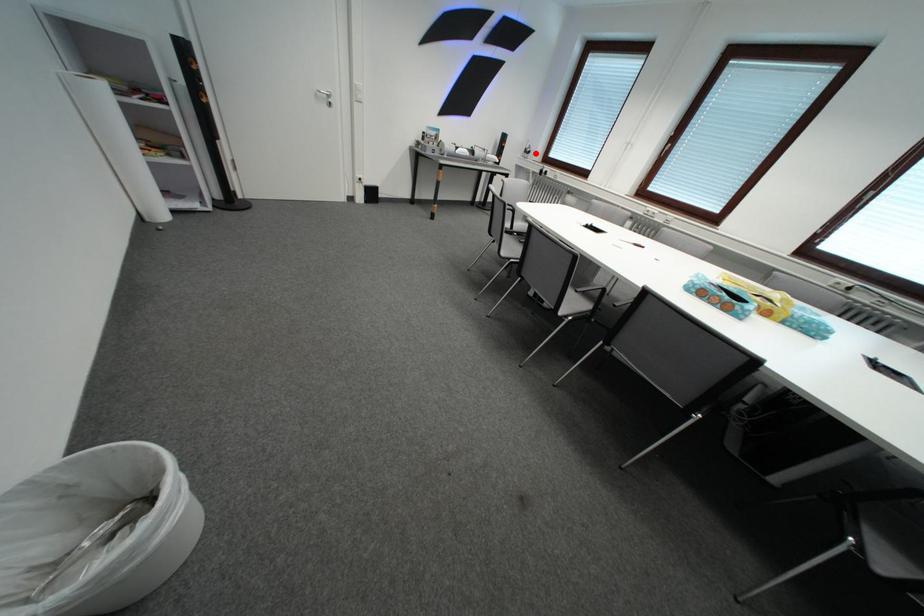
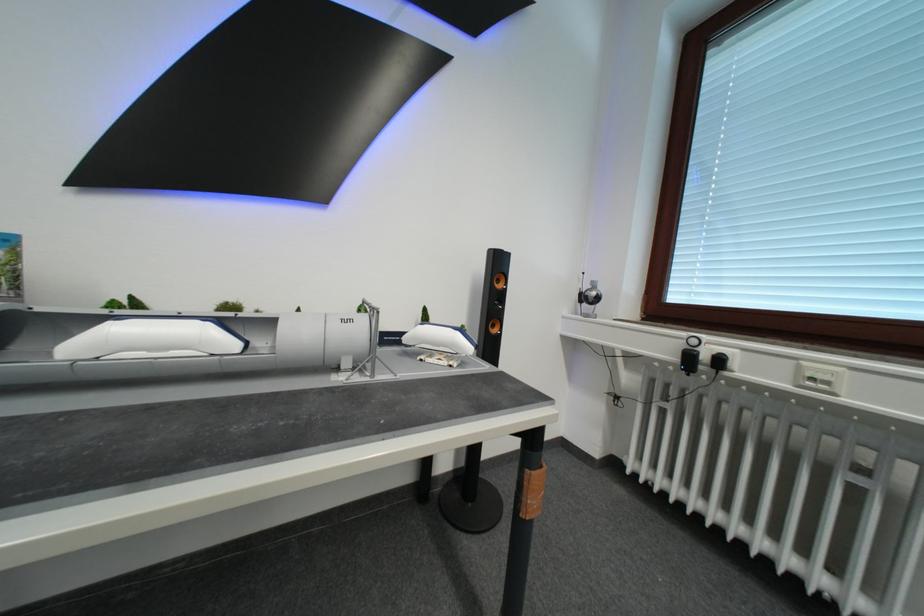
Locate, in the second image, the point that corresponds to the highlighted location in the first image.

(592, 301)